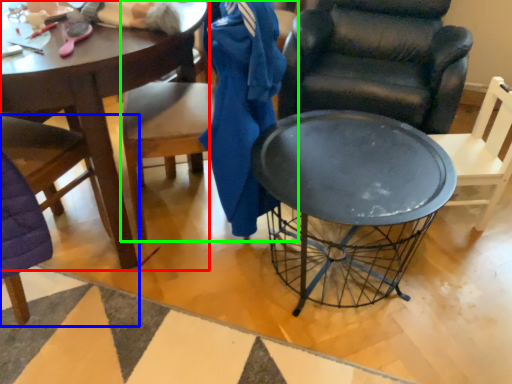
Question: Based on their relative distances, which object is farther from coffee table (highlighted by a red box)? Choose from chair (highlighted by a blue box) and chair (highlighted by a green box).

Choices:
 (A) chair
 (B) chair

Answer: (A)